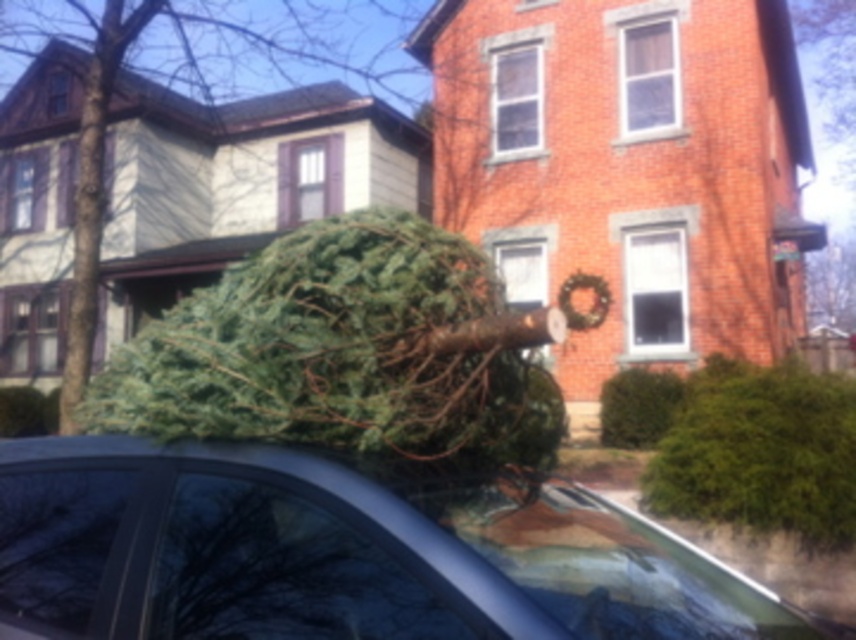
Question: Which object is closer to the camera taking this photo?

Choices:
 (A) brown shingles at upper left
 (B) brick at upper right
 (C) green natural tree at center

Answer: (C)

Question: Can you confirm if green rough textured tree at center is bigger than brown shingles at upper left?

Choices:
 (A) yes
 (B) no

Answer: (A)

Question: Which of these objects is positioned closest to the brick at upper right?

Choices:
 (A) brown shingles at upper left
 (B) green natural tree at center
 (C) metallic gray car at center

Answer: (A)

Question: Estimate the real-world distances between objects in this image. Which object is farther from the brown shingles at upper left?

Choices:
 (A) green natural tree at center
 (B) metallic gray car at center
 (C) green rough textured tree at center
 (D) brick at upper right

Answer: (A)

Question: In this image, where is metallic gray car at center located relative to brown shingles at upper left?

Choices:
 (A) left
 (B) right

Answer: (B)

Question: Can you confirm if green natural tree at center is smaller than brown shingles at upper left?

Choices:
 (A) no
 (B) yes

Answer: (B)